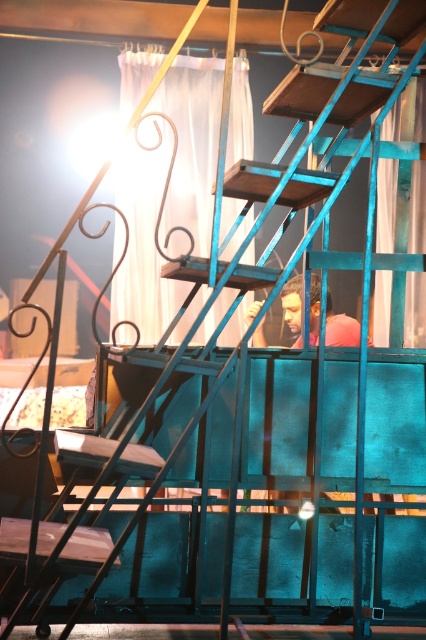
Can you confirm if translucent fabric curtain at upper center is positioned to the right of white sheer curtain at upper center?

Incorrect, translucent fabric curtain at upper center is not on the right side of white sheer curtain at upper center.

Does translucent fabric curtain at upper center have a lesser width compared to white sheer curtain at upper center?

No.

Is point (207, 227) farther from camera compared to point (419, 132)?

No, it is not.

Identify the location of translucent fabric curtain at upper center. (192, 144).

Between white sheer curtain at upper center and matte black head at center, which one is positioned lower?

Positioned lower is matte black head at center.

Can you confirm if white sheer curtain at upper center is taller than matte black head at center?

Correct, white sheer curtain at upper center is much taller as matte black head at center.

You are a GUI agent. You are given a task and a screenshot of the screen. Output one action in this format:
    pyautogui.click(x=<x>, y=<y>)
    Task: Click on the white sheer curtain at upper center
    The height and width of the screenshot is (640, 426).
    Given the screenshot: What is the action you would take?
    pyautogui.click(x=385, y=204)

Based on the photo, is translucent fabric curtain at upper center in front of matte black head at center?

No, translucent fabric curtain at upper center is further to the viewer.

Is the position of translucent fabric curtain at upper center more distant than that of matte black head at center?

Yes, translucent fabric curtain at upper center is further from the viewer.

Between point (206, 182) and point (342, 330), which one is positioned in front?

Point (342, 330) is in front.

Identify the location of translucent fabric curtain at upper center. (192, 144).